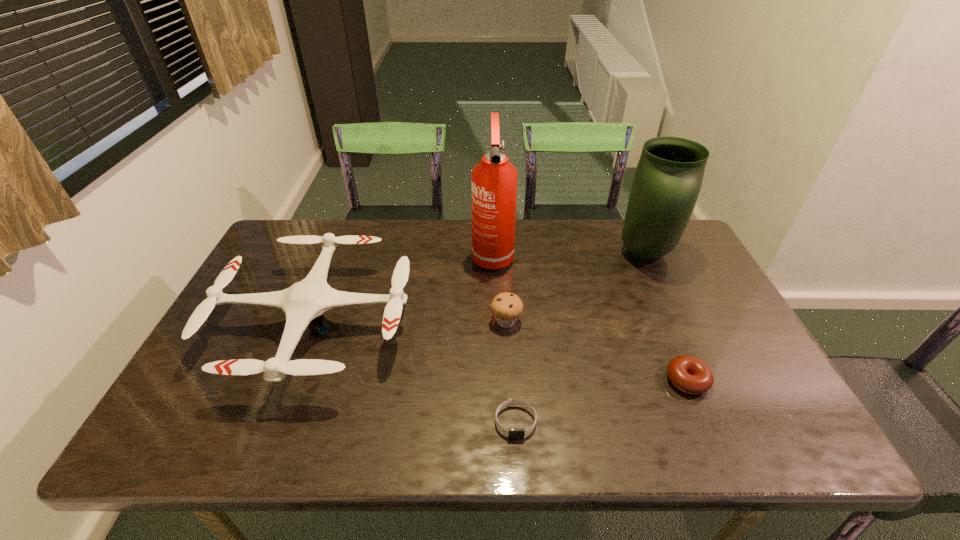
Locate an element on the screen. This screenshot has height=540, width=960. vacant space positioned 0.380m on the back of the third shortest object is located at coordinates (500, 230).

This screenshot has height=540, width=960. I want to click on vacant region located 0.090m on the back of the doughnut, so click(x=668, y=335).

You are a GUI agent. You are given a task and a screenshot of the screen. Output one action in this format:
    pyautogui.click(x=<x>, y=<y>)
    Task: Click on the fire extinguisher present at the far edge
    The width and height of the screenshot is (960, 540).
    Given the screenshot: What is the action you would take?
    pyautogui.click(x=494, y=180)

I want to click on vase at the far edge, so (x=669, y=175).

Where is `object that is at the near edge`? This screenshot has width=960, height=540. object that is at the near edge is located at coordinates (513, 433).

Locate an element on the screen. object situated at the left edge is located at coordinates (303, 303).

Find the location of `vase that is at the right edge`. vase that is at the right edge is located at coordinates (669, 175).

Identify the location of doughnut that is at the right edge. (689, 374).

In order to click on object that is at the far right corner in this screenshot , I will do `click(669, 175)`.

The height and width of the screenshot is (540, 960). What are the coordinates of `vacant area at the far edge` in the screenshot? It's located at (470, 236).